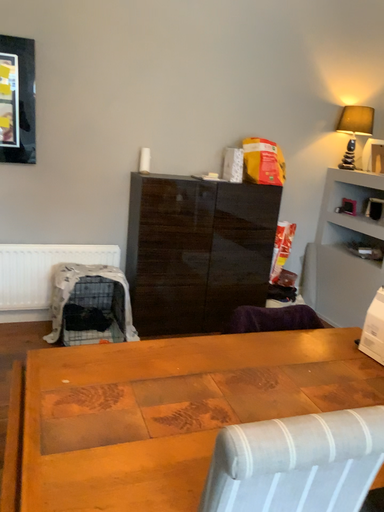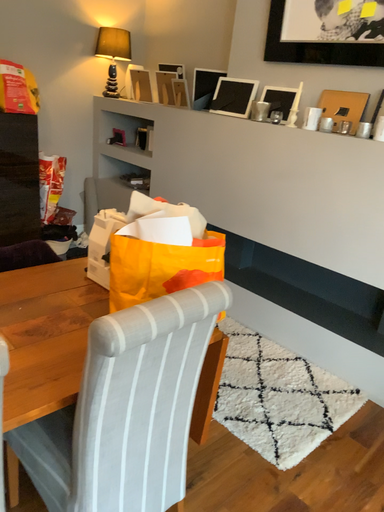
Question: How did the camera likely rotate when shooting the video?

Choices:
 (A) rotated left
 (B) rotated right

Answer: (B)